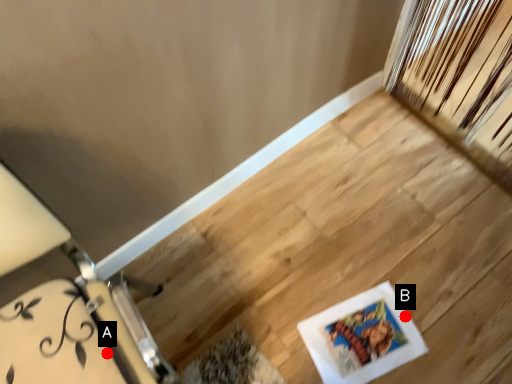
Question: Two points are circled on the image, labeled by A and B beside each circle. Which of the following is the farthest from the observer?

Choices:
 (A) A is further
 (B) B is further

Answer: (B)